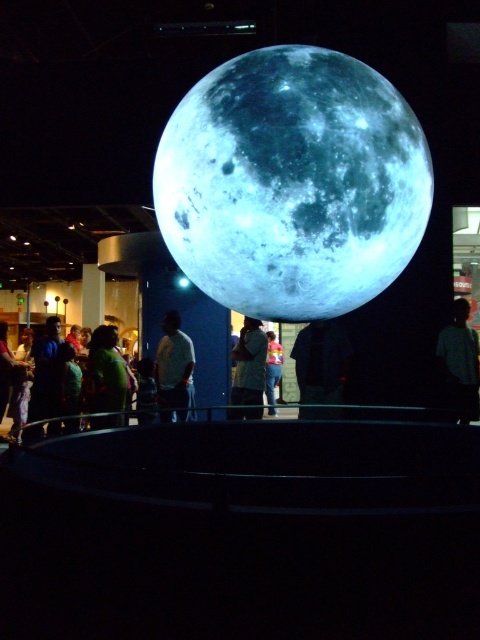
Question: Which point is closer to the camera taking this photo?

Choices:
 (A) (240, 394)
 (B) (267, 340)
 (C) (0, 390)
 (D) (467, 317)

Answer: (D)

Question: Can you confirm if dark gray shirt at center is thinner than green fabric shirt at left?

Choices:
 (A) no
 (B) yes

Answer: (A)

Question: Which object is farther from the camera taking this photo?

Choices:
 (A) matte white shirt at center
 (B) dark gray shirt at center
 (C) shiny metallic moon at center

Answer: (A)

Question: Is shiny metallic moon at center further to the viewer compared to blue fabric shirt at center?

Choices:
 (A) no
 (B) yes

Answer: (A)

Question: Is matte white shirt at center further to the viewer compared to yellow-green fabric shirt at center?

Choices:
 (A) no
 (B) yes

Answer: (A)

Question: Which of the following is the closest to the observer?

Choices:
 (A) (92, 346)
 (B) (7, 340)
 (C) (309, 339)
 (D) (240, 376)

Answer: (A)